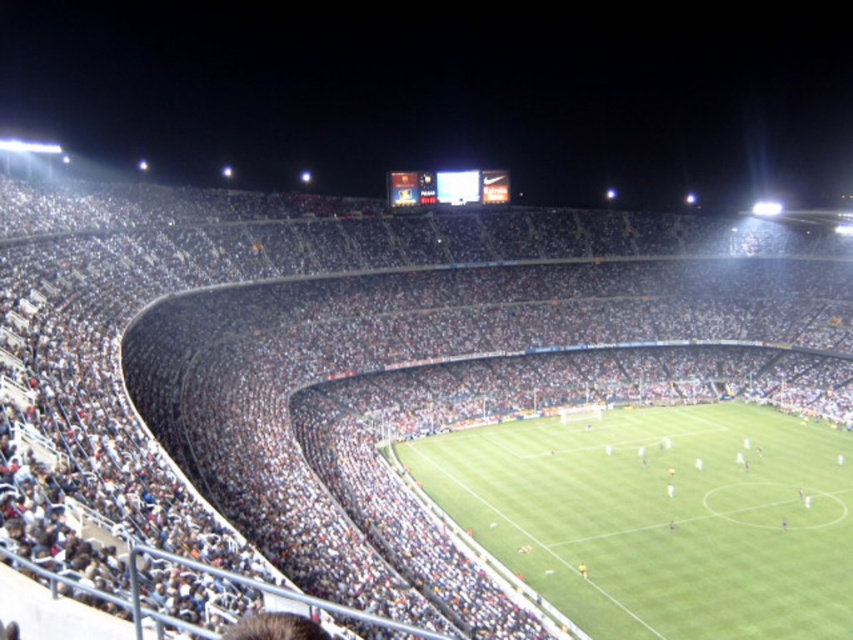
Does dark gray concrete seats at center have a lesser width compared to green grass football field at center?

No.

Which of these two, dark gray concrete seats at center or green grass football field at center, stands shorter?

green grass football field at center is shorter.

Is point (3, 177) less distant than point (537, 424)?

That is True.

Where is `dark gray concrete seats at center`? The height and width of the screenshot is (640, 853). dark gray concrete seats at center is located at coordinates (345, 342).